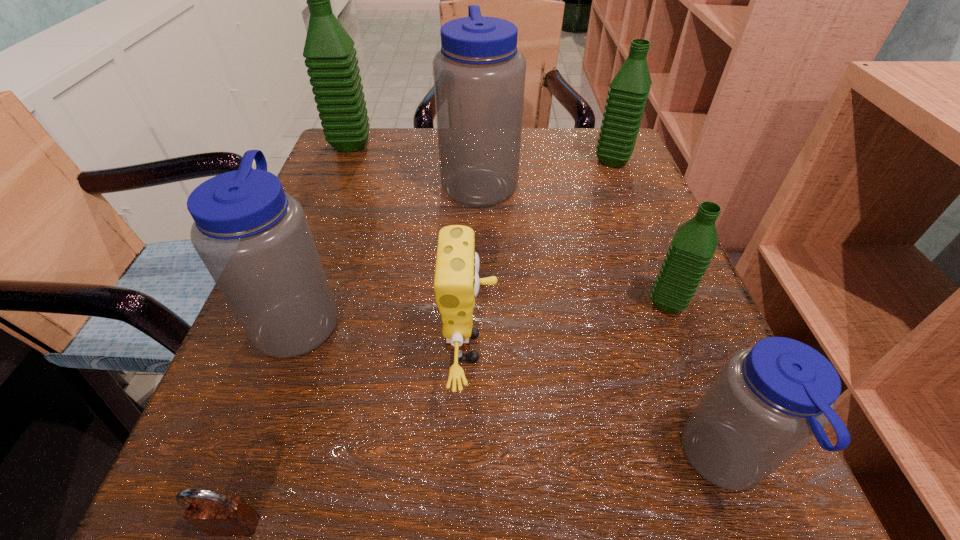
At what (x,y) coordinates should I click in order to perform the action: click on vacant space at the left edge. Please return your answer as a coordinate pair (x, y). The height and width of the screenshot is (540, 960). Looking at the image, I should click on (331, 345).

Image resolution: width=960 pixels, height=540 pixels. What are the coordinates of `vacant point at the right edge` in the screenshot? It's located at (617, 290).

At what (x,y) coordinates should I click in order to perform the action: click on vacant space at the far left corner of the desktop. Please return your answer as a coordinate pair (x, y). Image resolution: width=960 pixels, height=540 pixels. Looking at the image, I should click on (380, 139).

In the image, there is a desktop. Where is `vacant space at the near left corner`? This screenshot has height=540, width=960. vacant space at the near left corner is located at coordinates (167, 522).

The image size is (960, 540). Identify the location of vacant space at the far right corner of the desktop. (625, 166).

This screenshot has height=540, width=960. Identify the location of vacant area that lies between the nearest water bottle and the nearest green water bottle. (696, 382).

Where is `unoccupied area between the smallest green water bottle and the third water bottle from left to right`? The width and height of the screenshot is (960, 540). unoccupied area between the smallest green water bottle and the third water bottle from left to right is located at coordinates (573, 242).

Find the location of a particular element. vacant space that is in between the nearest green water bottle and the second blue water bottle from left to right is located at coordinates (573, 242).

The height and width of the screenshot is (540, 960). In order to click on vacant area that lies between the nearest water bottle and the biggest green water bottle in this screenshot , I will do `click(538, 303)`.

You are a GUI agent. You are given a task and a screenshot of the screen. Output one action in this format:
    pyautogui.click(x=<x>, y=<y>)
    Task: Click on the free space between the second blue water bottle from left to right and the second nearest blue water bottle
    This screenshot has height=540, width=960.
    Given the screenshot: What is the action you would take?
    pyautogui.click(x=390, y=250)